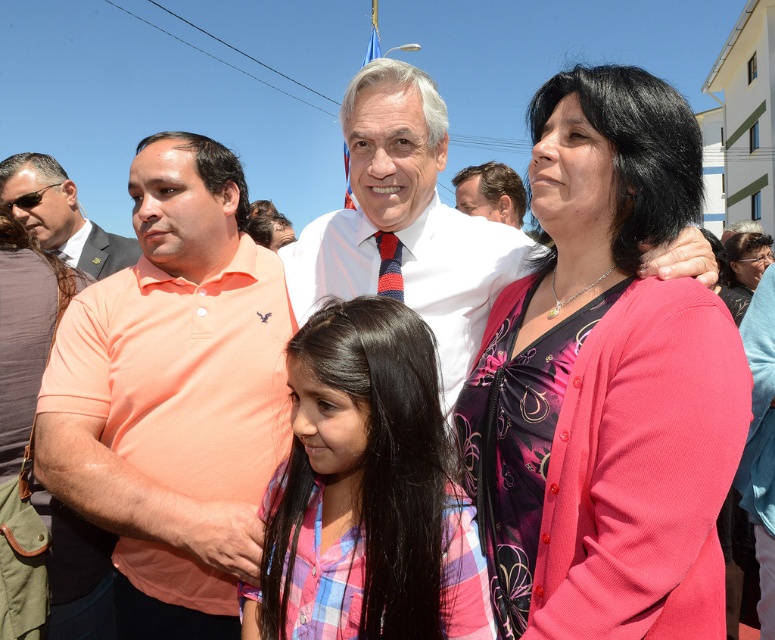
From the picture: Which of these two, pink matte cardigan at center or plaid fabric shirt at center, stands taller?

pink matte cardigan at center

Based on the photo, who is higher up, pink matte cardigan at center or plaid fabric shirt at center?

pink matte cardigan at center is above.

Who is more forward, (691, 477) or (401, 378)?

Point (691, 477)

This screenshot has height=640, width=775. In order to click on pink matte cardigan at center in this screenshot , I will do `click(605, 384)`.

Who is higher up, smooth white shirt at center or red and blue striped tie at center?

Positioned higher is smooth white shirt at center.

From the picture: Is smooth white shirt at center positioned at the back of red and blue striped tie at center?

Yes, smooth white shirt at center is further from the viewer.

Who is more forward, (517,227) or (391,237)?

Point (391,237) is in front.

Find the location of a particular element. This screenshot has width=775, height=640. smooth white shirt at center is located at coordinates pyautogui.click(x=491, y=193).

Is plaid fabric shirt at center positioned at the back of matte black suit at left?

That is False.

Is point (443, 449) positioned after point (95, 250)?

No, (443, 449) is closer to viewer.

This screenshot has width=775, height=640. I want to click on plaid fabric shirt at center, so click(367, 490).